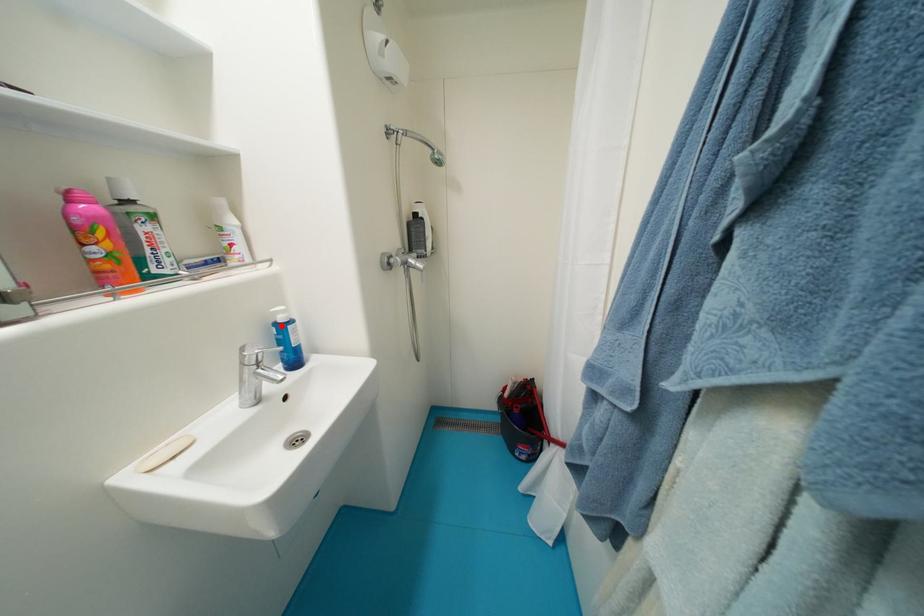
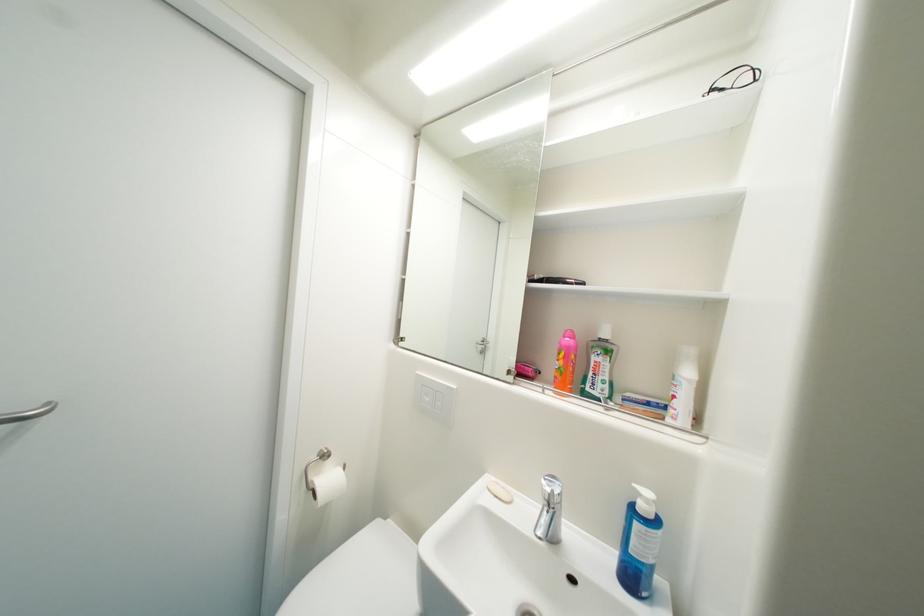
The point at the highlighted location is marked in the first image. Where is the corresponding point in the second image?

(641, 507)